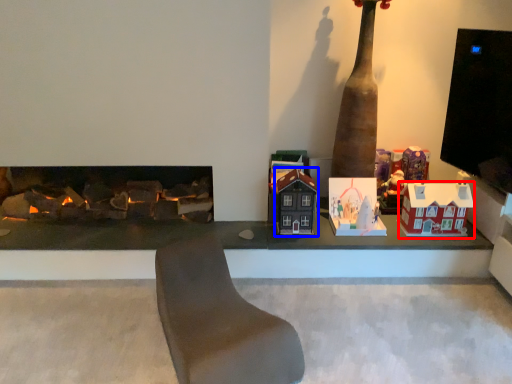
Question: Which object appears farthest to the camera in this image, toy (highlighted by a red box) or toy (highlighted by a blue box)?

Choices:
 (A) toy
 (B) toy

Answer: (A)